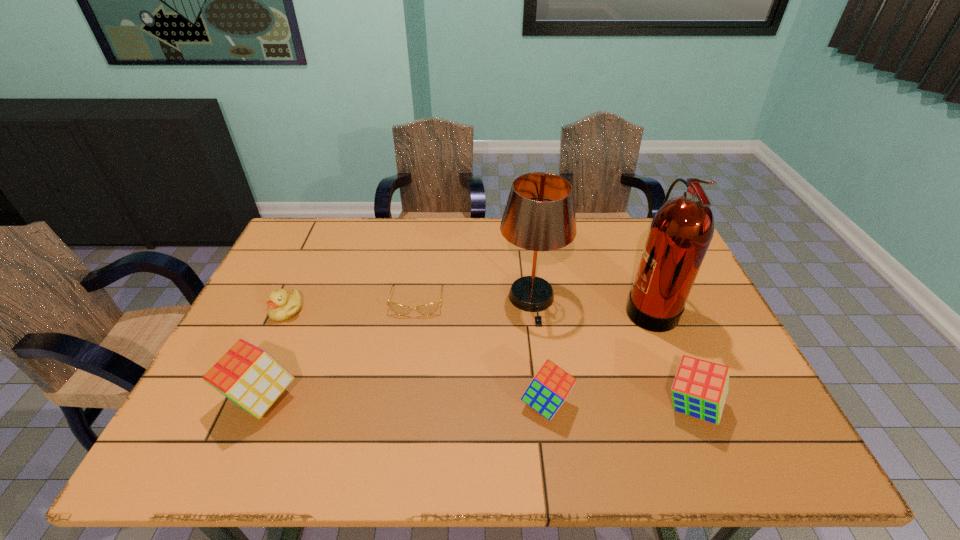
Image resolution: width=960 pixels, height=540 pixels. What are the coordinates of `vacant region located 0.300m on the right of the leftmost cube` in the screenshot? It's located at [427, 398].

Identify the location of free space located on the right of the second cube from left to right. This screenshot has height=540, width=960. (686, 403).

Identify the location of vacant space located on the back of the rightmost cube. (641, 285).

I want to click on free space located on the front-facing side of the fire extinguisher, so click(x=595, y=307).

At what (x,y) coordinates should I click in order to perform the action: click on free point located 0.310m on the front-facing side of the fire extinguisher. Please return your answer as a coordinate pair (x, y). Looking at the image, I should click on (515, 307).

Image resolution: width=960 pixels, height=540 pixels. I want to click on free space located 0.360m on the front-facing side of the fire extinguisher, so click(497, 307).

In order to click on vacant space located 0.230m on the front-facing side of the shortest object in this screenshot , I will do `click(403, 387)`.

Find the location of a particular element. This screenshot has width=960, height=540. free location located 0.130m on the front-facing side of the duckling is located at coordinates (263, 361).

I want to click on vacant space located on the front-facing side of the lampshade, so click(x=540, y=362).

Identify the location of cube situated at the left edge. (250, 377).